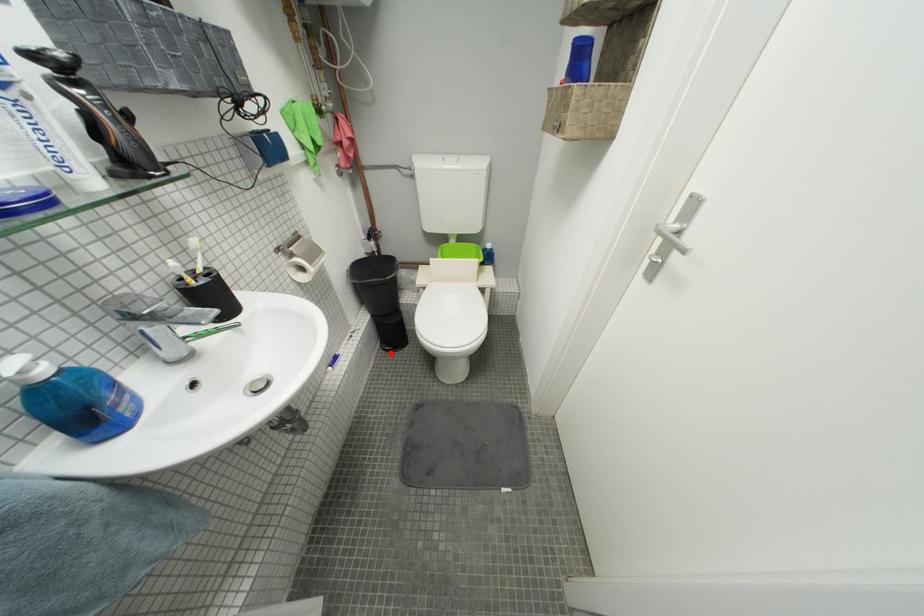
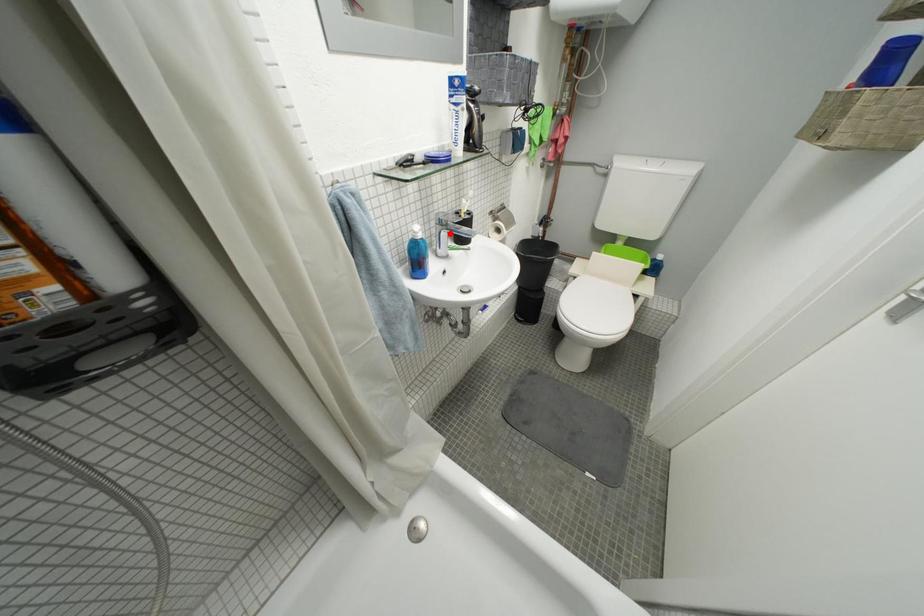
I am providing you with two images of the same scene from different viewpoints. A red point is marked on the first image and another point is marked on the second image. Does the point marked in image1 correspond to the same location as the one in image2?

No